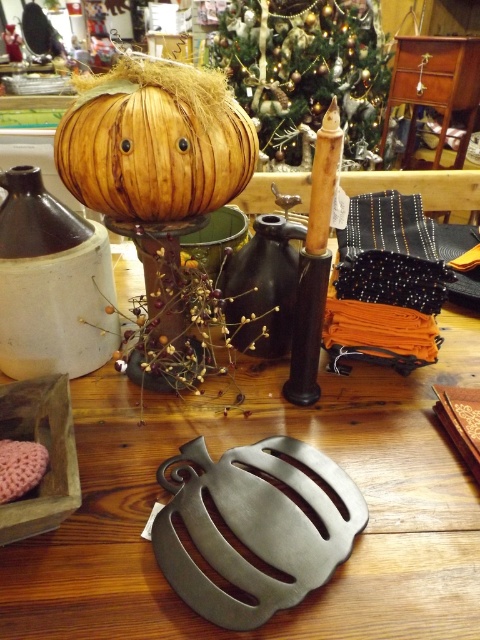
Question: Does metallic gray trivet at center have a lesser width compared to wooden pumpkin at center?

Choices:
 (A) yes
 (B) no

Answer: (B)

Question: Which point is closer to the camera?

Choices:
 (A) wooden pumpkin at center
 (B) metallic gray trivet at center

Answer: (B)

Question: Is metallic gray trivet at center thinner than wooden pumpkin at center?

Choices:
 (A) yes
 (B) no

Answer: (B)

Question: Considering the relative positions of metallic gray trivet at center and wooden pumpkin at center in the image provided, where is metallic gray trivet at center located with respect to wooden pumpkin at center?

Choices:
 (A) left
 (B) right

Answer: (B)

Question: Which point appears closest to the camera in this image?

Choices:
 (A) (108, 122)
 (B) (468, 561)

Answer: (B)